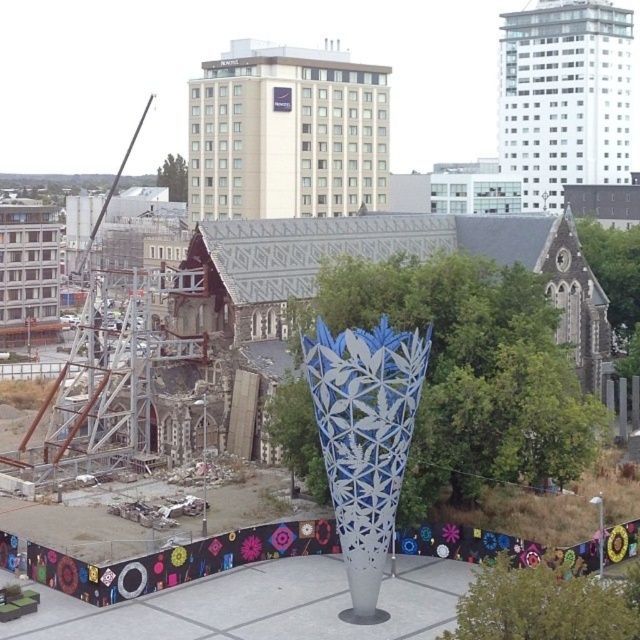
Does green leafy tree at upper right appear over green leafy tree at upper center?

Actually, green leafy tree at upper right is below green leafy tree at upper center.

Which is behind, point (627, 276) or point (184, 168)?

Point (184, 168)

I want to click on green leafy tree at upper right, so click(x=614, y=273).

Between green leafy tree at center and green leafy tree at upper center, which one is positioned lower?

green leafy tree at center

Is green leafy tree at center taller than green leafy tree at upper center?

Yes.

Does point (410, 480) come farther from viewer compared to point (177, 198)?

No, it is in front of (177, 198).

Where is `green leafy tree at center`? This screenshot has width=640, height=640. green leafy tree at center is located at coordinates (468, 372).

Which is in front, point (504, 596) or point (156, 176)?

Point (504, 596)

Does green leafy tree at lower right appear over green leafy tree at upper center?

Incorrect, green leafy tree at lower right is not positioned above green leafy tree at upper center.

Is point (621, 618) positioned after point (176, 177)?

No, it is in front of (176, 177).

The height and width of the screenshot is (640, 640). Identify the location of green leafy tree at lower right. (541, 605).